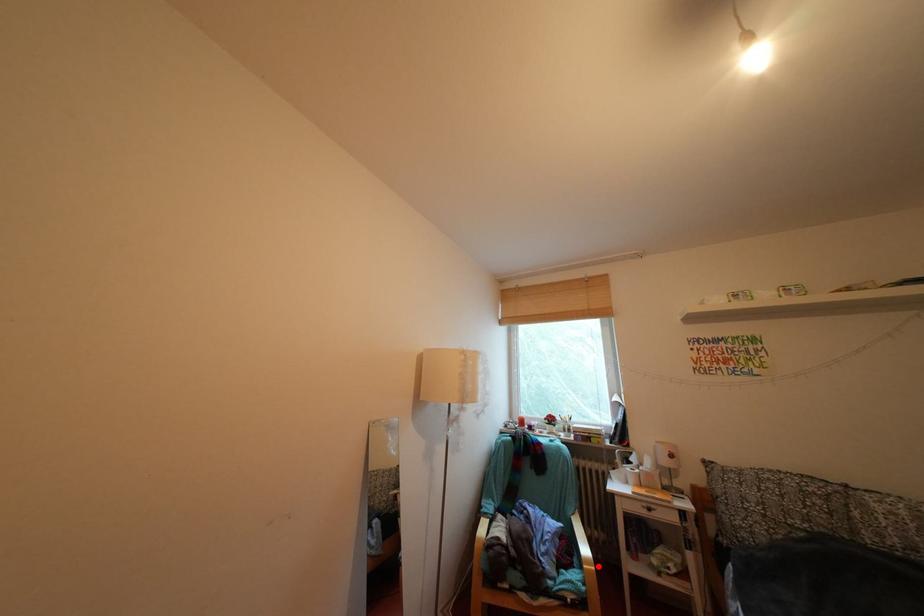
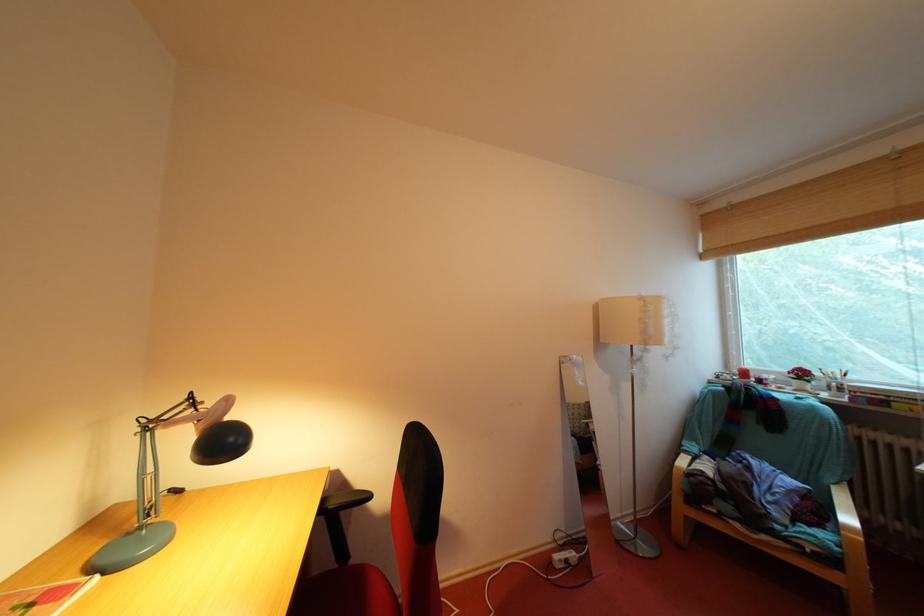
Question: I am providing you with two images of the same scene from different viewpoints. In image1, a red point is highlighted. Considering the same 3D point in image2, which of the following is correct?

Choices:
 (A) It is closer
 (B) It is farther

Answer: (A)